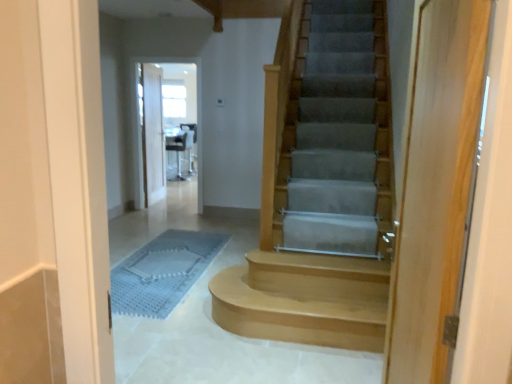
Question: Is light brown wood stairs at center in front of or behind smooth concrete stairs at center in the image?

Choices:
 (A) front
 (B) behind

Answer: (B)

Question: In terms of width, does light brown wood stairs at center look wider or thinner when compared to smooth concrete stairs at center?

Choices:
 (A) wide
 (B) thin

Answer: (B)

Question: Estimate the real-world distances between objects in this image. Which object is farther from the white glossy chair at upper center?

Choices:
 (A) light brown wood stairs at center
 (B) white wood door at upper center, the 2th door in the right-to-left sequence
 (C) light wood door at right, which is the first door in front-to-back order
 (D) blue textured bath mat at lower center
 (E) clear glass screen door at center

Answer: (C)

Question: Based on their relative distances, which object is farther from the light brown wood stairs at center?

Choices:
 (A) white glossy chair at upper center
 (B) clear glass screen door at center
 (C) white wood door at upper center, which is the second door in front-to-back order
 (D) smooth concrete stairs at center
 (E) blue textured bath mat at lower center

Answer: (A)